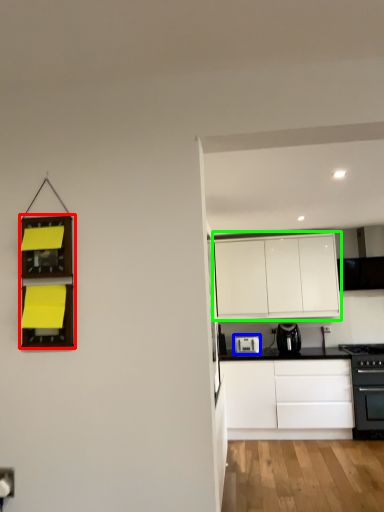
Question: Based on their relative distances, which object is nearer to shelf (highlighted by a red box)? Choose from kitchen appliance (highlighted by a blue box) and cabinetry (highlighted by a green box).

Choices:
 (A) kitchen appliance
 (B) cabinetry

Answer: (A)